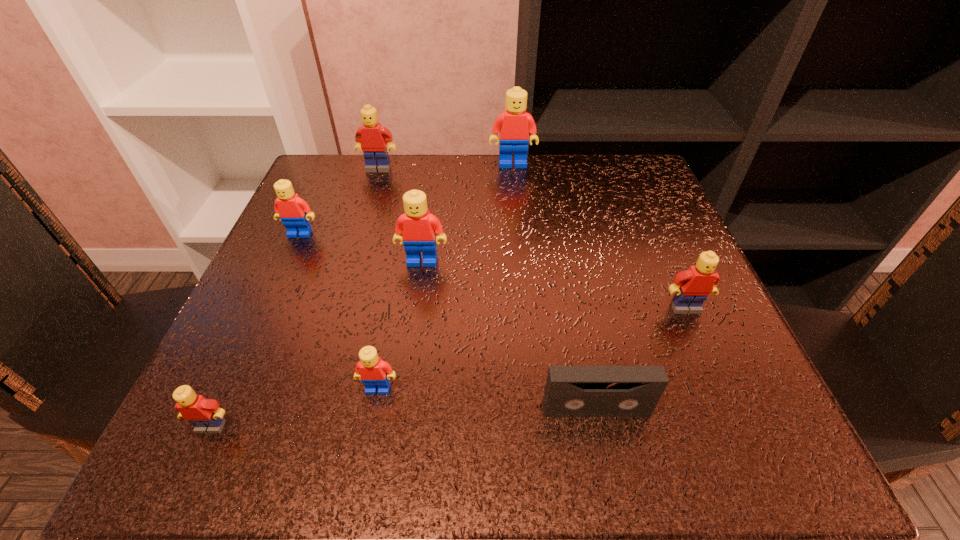
Identify the location of vacant area at the right edge of the desktop. This screenshot has width=960, height=540. (644, 254).

Locate an element on the screen. The image size is (960, 540). vacant space at the far left corner is located at coordinates (356, 189).

Image resolution: width=960 pixels, height=540 pixels. I want to click on vacant space at the near left corner of the desktop, so click(187, 444).

Identify the location of free space at the far right corner of the desktop. This screenshot has height=540, width=960. (583, 156).

Locate an element on the screen. vacant space in between the second nearest object and the tallest object is located at coordinates (554, 287).

Identify the location of free space that is in between the nearest object and the third biggest red Lego. This screenshot has width=960, height=540. (255, 330).

Image resolution: width=960 pixels, height=540 pixels. Find the location of `vacant area that lies between the fifth Lego from right to left and the nearest object`. vacant area that lies between the fifth Lego from right to left and the nearest object is located at coordinates (295, 298).

Where is `free space that is in between the second nearest Lego and the second farthest yellow Lego`? Image resolution: width=960 pixels, height=540 pixels. free space that is in between the second nearest Lego and the second farthest yellow Lego is located at coordinates (532, 348).

Where is `free point between the smallest red Lego and the sixth nearest object`? This screenshot has width=960, height=540. free point between the smallest red Lego and the sixth nearest object is located at coordinates (339, 312).

At what (x,y) coordinates should I click in order to perform the action: click on blank region between the videotape and the biggest yellow Lego. Please return your answer as a coordinate pair (x, y). Image resolution: width=960 pixels, height=540 pixels. Looking at the image, I should click on (487, 289).